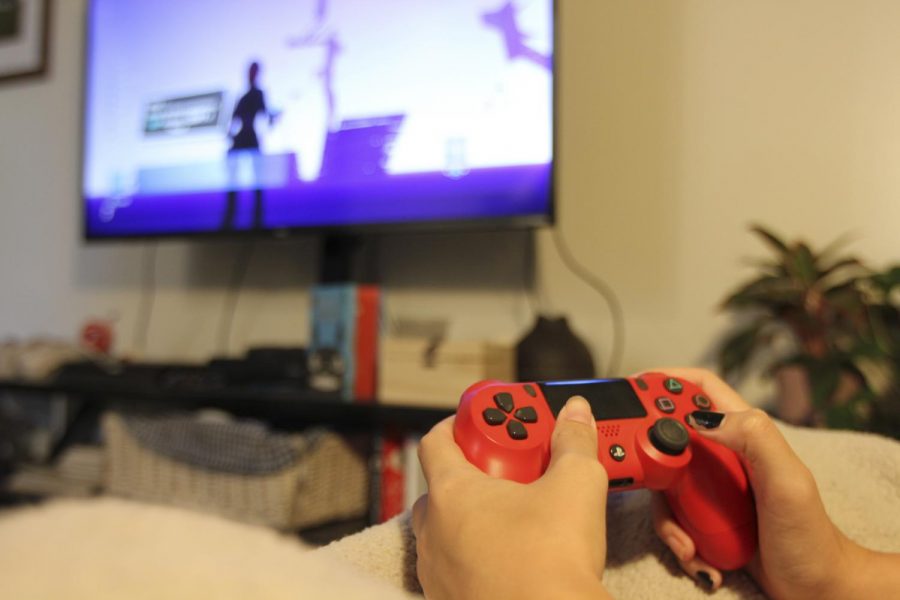
Find the location of `plant`. plant is located at coordinates (799, 287).